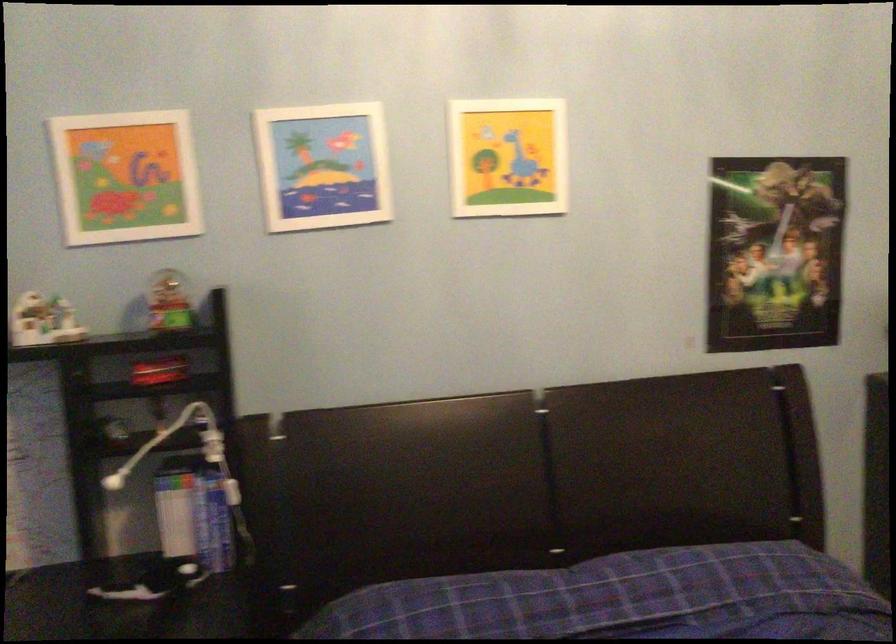
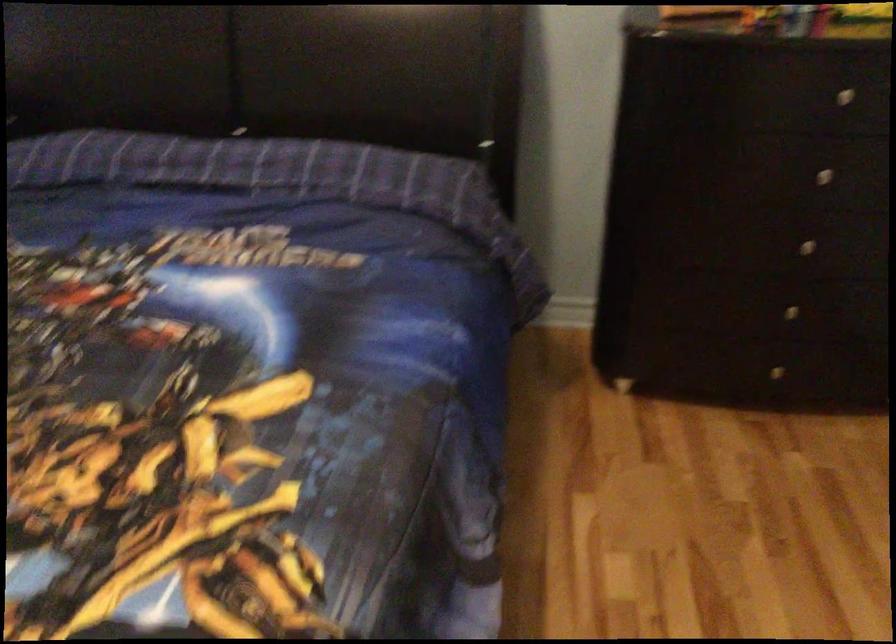
Question: What movement of the cameraman would produce the second image?

Choices:
 (A) Left
 (B) Right
 (C) Forward
 (D) Backward

Answer: (B)